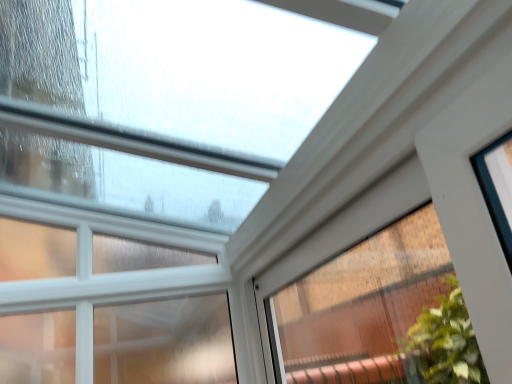
Question: From the image's perspective, is clear glass window at upper center, acting as the second window starting from the right, located above or below clear glass window at upper center, the 2th window from the left?

Choices:
 (A) above
 (B) below

Answer: (B)

Question: Is clear glass window at upper center, which is counted as the first window, starting from the left, spatially inside clear glass window at upper center, the 2th window from the left, or outside of it?

Choices:
 (A) inside
 (B) outside

Answer: (B)

Question: Considering the positions of clear glass window at upper center, which is counted as the first window, starting from the left, and clear glass window at upper center, which is counted as the 1th window, starting from the right, in the image, is clear glass window at upper center, which is counted as the first window, starting from the left, bigger or smaller than clear glass window at upper center, which is counted as the 1th window, starting from the right,?

Choices:
 (A) small
 (B) big

Answer: (B)

Question: Considering the positions of clear glass window at upper center, which is counted as the 1th window, starting from the right, and clear glass window at upper center, acting as the second window starting from the right, in the image, is clear glass window at upper center, which is counted as the 1th window, starting from the right, bigger or smaller than clear glass window at upper center, acting as the second window starting from the right,?

Choices:
 (A) big
 (B) small

Answer: (B)

Question: Is clear glass window at upper center, the 2th window from the left, spatially inside clear glass window at upper center, which is counted as the first window, starting from the left, or outside of it?

Choices:
 (A) outside
 (B) inside

Answer: (A)

Question: Considering the positions of clear glass window at upper center, which is counted as the 1th window, starting from the right, and clear glass window at upper center, acting as the second window starting from the right, in the image, is clear glass window at upper center, which is counted as the 1th window, starting from the right, taller or shorter than clear glass window at upper center, acting as the second window starting from the right,?

Choices:
 (A) short
 (B) tall

Answer: (A)

Question: Considering the positions of point pyautogui.click(x=365, y=259) and point pyautogui.click(x=25, y=326), is point pyautogui.click(x=365, y=259) closer or farther from the camera than point pyautogui.click(x=25, y=326)?

Choices:
 (A) farther
 (B) closer

Answer: (A)